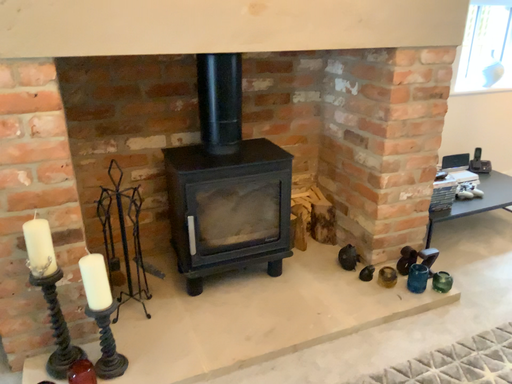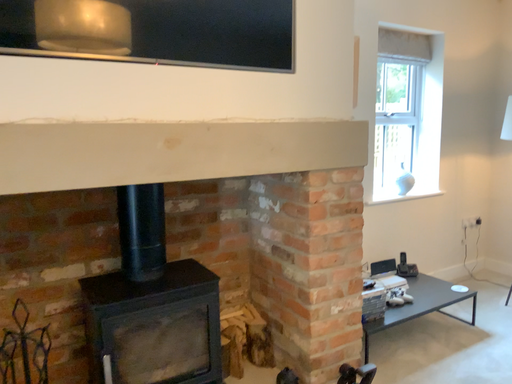
Question: How did the camera likely rotate when shooting the video?

Choices:
 (A) rotated upward
 (B) rotated downward

Answer: (A)